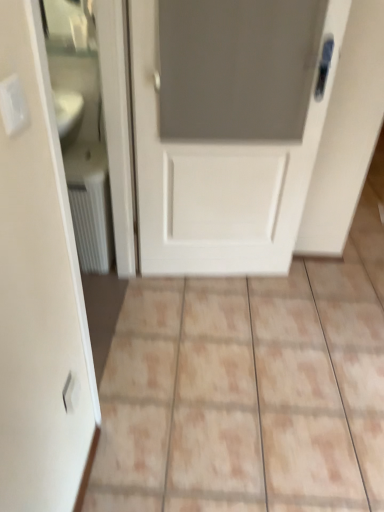
Locate an element on the screen. The height and width of the screenshot is (512, 384). free space below white matte door at center (from a real-world perspective) is located at coordinates (222, 278).